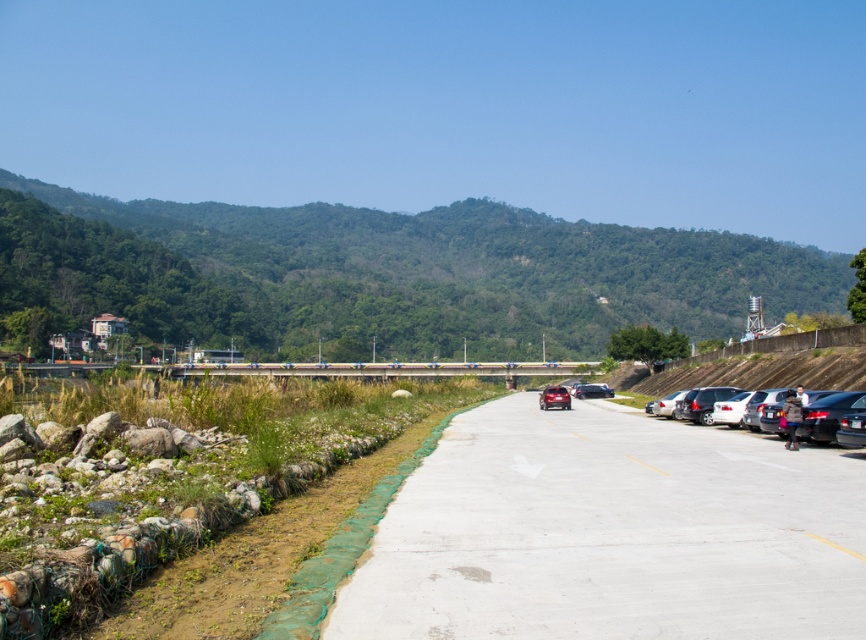
You are driving a car and see the smooth asphalt road at center and the metallic highway at center. Which one is positioned to the right side?

The smooth asphalt road at center is positioned to the right of the metallic highway at center.